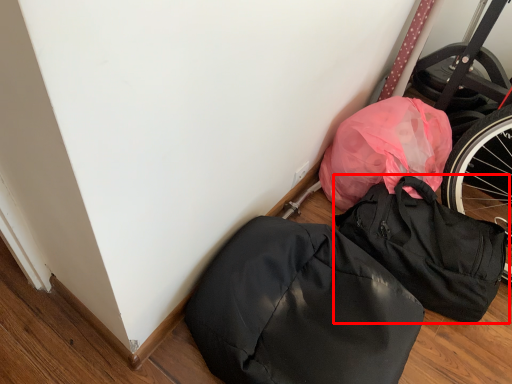
Question: From the image's perspective, where is backpack (annotated by the red box) located in relation to backpack in the image?

Choices:
 (A) above
 (B) below

Answer: (A)